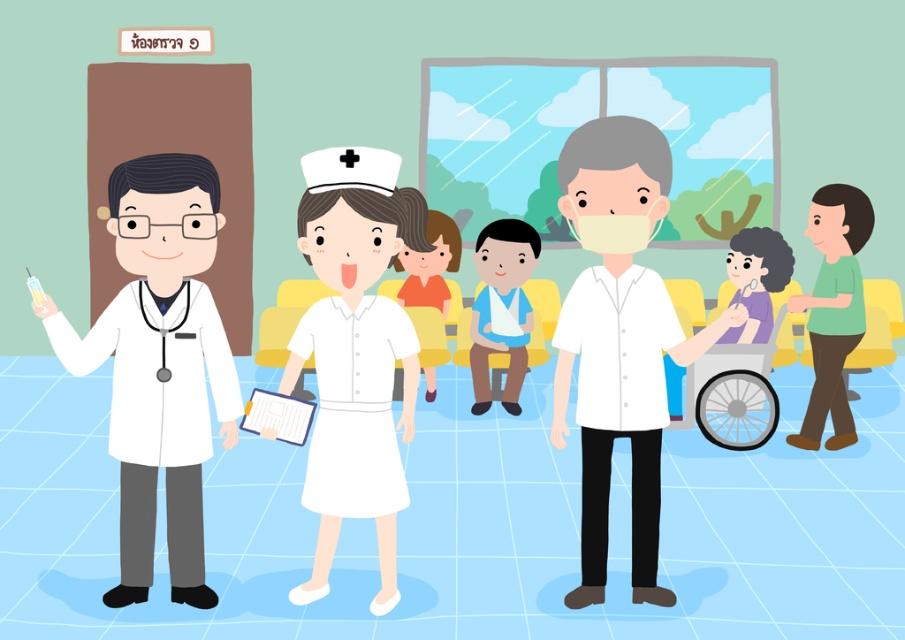
You are a patient in the hospital and need to locate the doctor wearing a white matte doctor coat at left. Where exactly should you look in the image?

The white matte doctor coat at left is located at point (159, 364) in the image.

You are a patient in the hospital and need to locate the doctor wearing the white matte doctor coat at left and the person in white matte shirt at center. From your perspective facing the scene, which direction should you look first to see both individuals?

You should look to the left first to see the white matte doctor coat at left, then shift your gaze to the center to see the white matte shirt at center since the white matte doctor coat at left is positioned to the left of the white matte shirt at center.